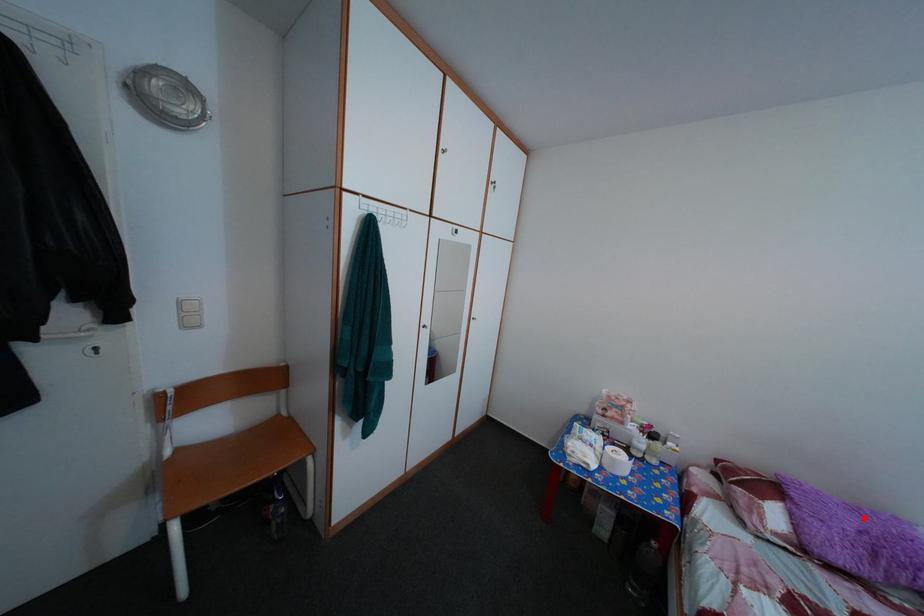
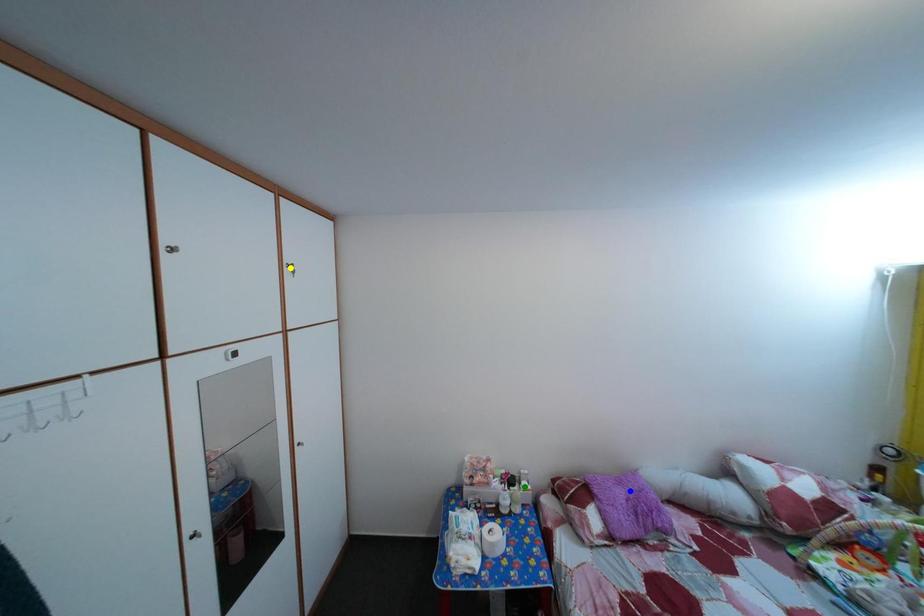
Question: I am providing you with two images of the same scene from different viewpoints. A red point is marked on the first image. You are given multiple points on the second image. Which mark in image 2 goes with the point in image 1?

Choices:
 (A) green point
 (B) blue point
 (C) yellow point

Answer: (B)